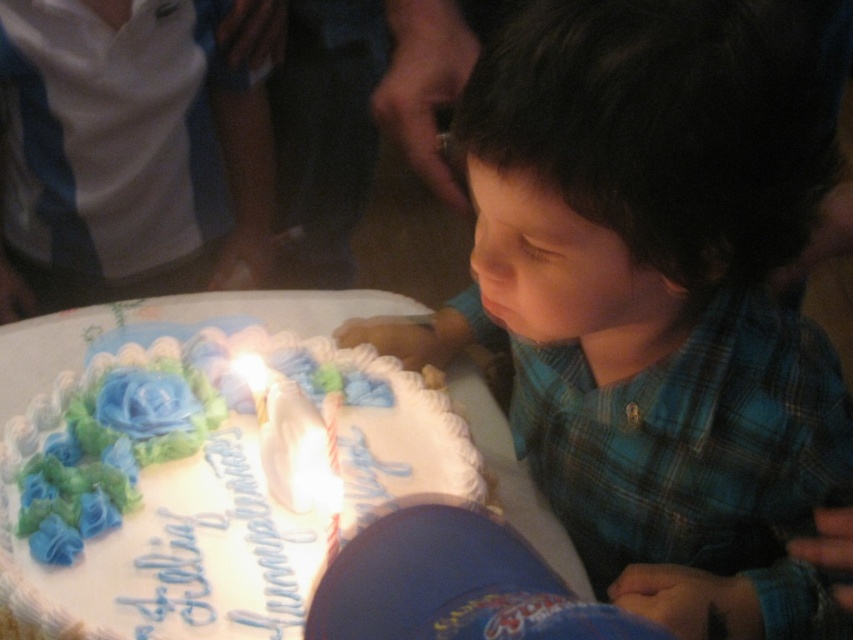
You are at the birthday celebration and want to find the child blowing out the candle. Where is the blue plaid shirt at center located in the image?

The blue plaid shirt at center is located at point (656, 298).

You are a photographer at the birthday celebration. You want to take a photo of the blue plaid shirt at center and the lit candle being blown out. How far apart are these two objects in the scene?

The blue plaid shirt at center and the lit candle are 46.26 centimeters apart.

Consider the image. You are taking a photo of the birthday cake and need to focus on both the lit candle and the child blowing it out. The lit candle is at point (670, 348) and the child is at point (247, 356). Which point should you focus on first to ensure both are in focus?

Point (670, 348) is closer to the camera than point (247, 356). To ensure both are in focus, focus on the closer point, point (670, 348), first.